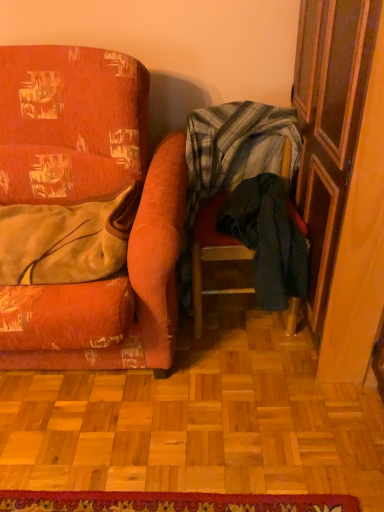
Question: Would you say velvet-like beige blanket at left, which appears as the first clothing when viewed from the left, is part of red woven mat at lower center's contents?

Choices:
 (A) no
 (B) yes

Answer: (A)

Question: Is red woven mat at lower center positioned in front of velvet-like beige blanket at left, which appears as the first clothing when viewed from the left?

Choices:
 (A) yes
 (B) no

Answer: (A)

Question: Is the position of red woven mat at lower center more distant than that of velvet-like beige blanket at left, which appears as the first clothing when viewed from the left?

Choices:
 (A) no
 (B) yes

Answer: (A)

Question: Considering the relative positions of red woven mat at lower center and velvet-like beige blanket at left, which appears as the first clothing when viewed from the left, in the image provided, is red woven mat at lower center to the right of velvet-like beige blanket at left, which appears as the first clothing when viewed from the left, from the viewer's perspective?

Choices:
 (A) no
 (B) yes

Answer: (B)

Question: Is red woven mat at lower center oriented towards velvet-like beige blanket at left, which appears as the first clothing when viewed from the left?

Choices:
 (A) yes
 (B) no

Answer: (B)

Question: Considering the relative sizes of red woven mat at lower center and velvet-like beige blanket at left, which appears as the first clothing when viewed from the left, in the image provided, is red woven mat at lower center shorter than velvet-like beige blanket at left, which appears as the first clothing when viewed from the left,?

Choices:
 (A) yes
 (B) no

Answer: (A)

Question: Can you confirm if dark green fabric at lower right, positioned as the 1th clothing in right-to-left order, is positioned to the left of wooden screen door at right?

Choices:
 (A) yes
 (B) no

Answer: (A)

Question: Is dark green fabric at lower right, positioned as the 1th clothing in right-to-left order, thinner than wooden screen door at right?

Choices:
 (A) yes
 (B) no

Answer: (A)

Question: Is dark green fabric at lower right, positioned as the 1th clothing in right-to-left order, behind wooden screen door at right?

Choices:
 (A) no
 (B) yes

Answer: (B)

Question: Does dark green fabric at lower right, positioned as the 1th clothing in right-to-left order, contain wooden screen door at right?

Choices:
 (A) no
 (B) yes

Answer: (A)

Question: Is dark green fabric at lower right, positioned as the 1th clothing in right-to-left order, oriented away from wooden screen door at right?

Choices:
 (A) yes
 (B) no

Answer: (B)

Question: Is dark green fabric at lower right, positioned as the 1th clothing in right-to-left order, not near wooden screen door at right?

Choices:
 (A) no
 (B) yes

Answer: (A)

Question: From a real-world perspective, is distressed orange fabric chair at left, the first chair viewed from the left, over wooden screen door at right?

Choices:
 (A) no
 (B) yes

Answer: (A)